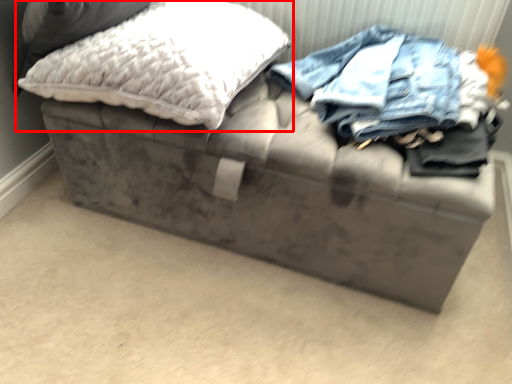
Question: From the image's perspective, considering the relative positions of pillow (annotated by the red box) and pillow in the image provided, where is pillow (annotated by the red box) located with respect to the staircase?

Choices:
 (A) below
 (B) above

Answer: (A)